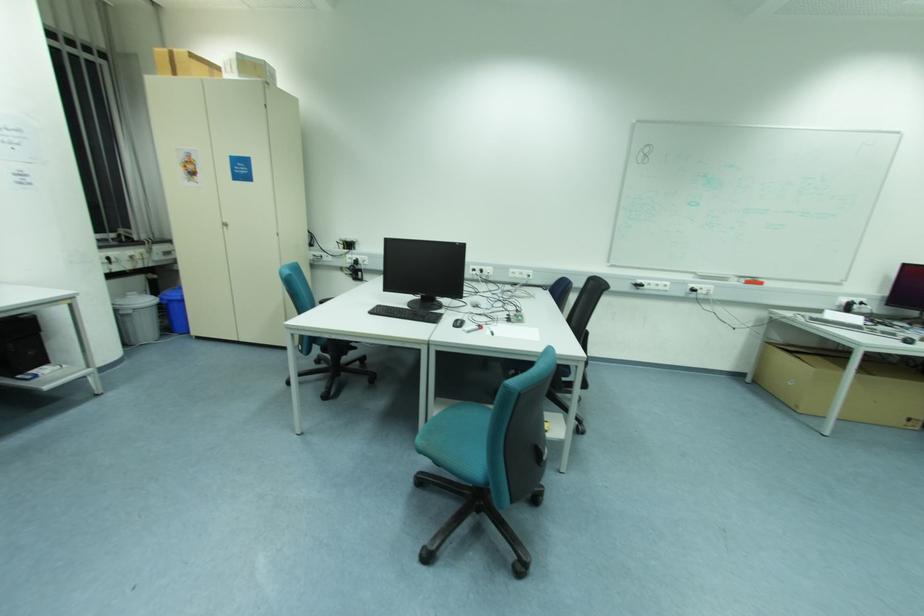
This screenshot has height=616, width=924. I want to click on teal chair sitting surface, so click(x=465, y=438).